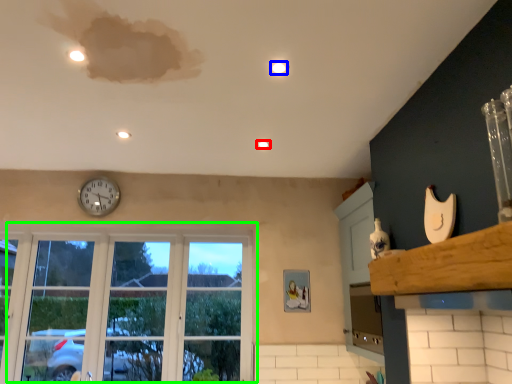
Question: Considering the real-world distances, which object is farthest from light (highlighted by a red box)? light (highlighted by a blue box) or window (highlighted by a green box)?

Choices:
 (A) light
 (B) window

Answer: (B)